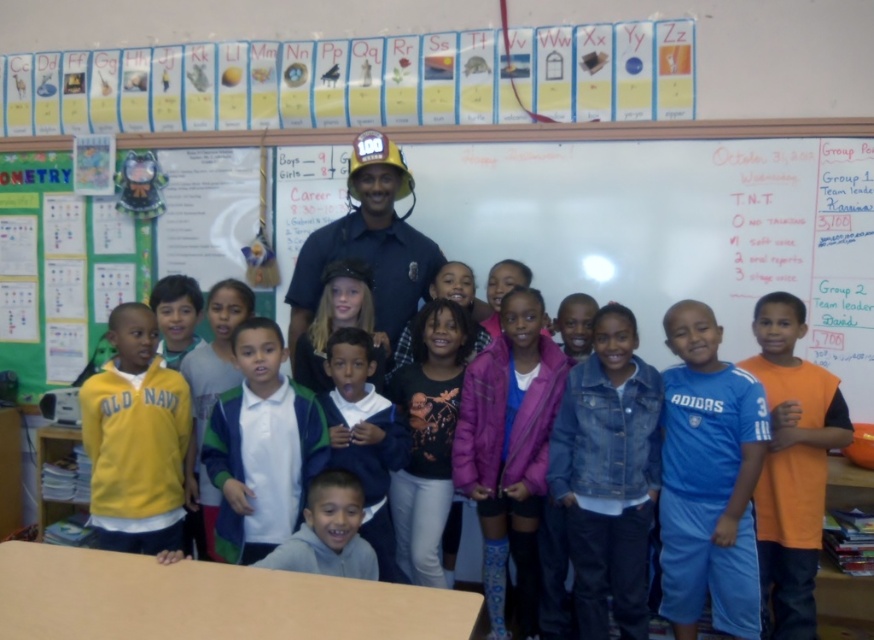
Question: Considering the relative positions of whiteboard at upper center and orange jersey at right in the image provided, where is whiteboard at upper center located with respect to orange jersey at right?

Choices:
 (A) above
 (B) below

Answer: (A)

Question: Is dark blue uniform at center to the left of black matte shirt at center from the viewer's perspective?

Choices:
 (A) yes
 (B) no

Answer: (A)

Question: Estimate the real-world distances between objects in this image. Which object is closer to the white fleece jacket at center?

Choices:
 (A) denim jacket at center
 (B) matte black jacket at center
 (C) whiteboard at upper center

Answer: (B)

Question: Is white cotton shirt at center bigger than white fleece jacket at center?

Choices:
 (A) yes
 (B) no

Answer: (A)

Question: Which of the following is the closest to the observer?

Choices:
 (A) (222, 406)
 (B) (525, 509)

Answer: (A)

Question: Among these objects, which one is nearest to the camera?

Choices:
 (A) black matte shirt at center
 (B) yellow fleece jacket at lower left
 (C) whiteboard at upper center
 (D) orange jersey at right

Answer: (B)